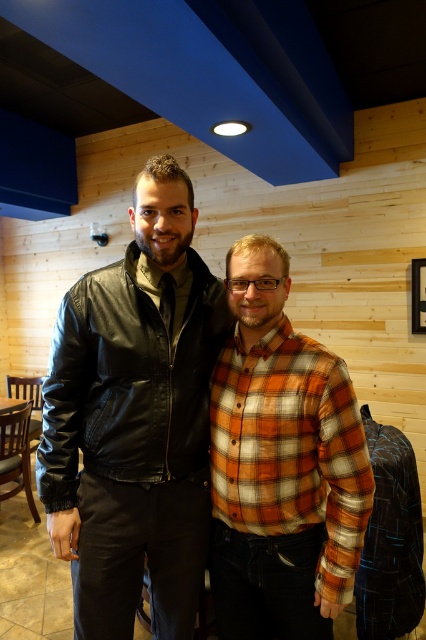
You are a photographer setting up for a portrait. You have a camera with a focal length of 50mm and want to ensure both the black leather jacket at center and orange plaid shirt at center are in focus. Given that the depth of field at this focal length allows objects within 10 centimeters of each other to be in focus, will both subjects be sharp in the photo?

The black leather jacket at center and orange plaid shirt at center are 13.79 centimeters apart from each other. Since the depth of field only allows objects within 10 centimeters to be in focus, the distance between them exceeds this limit. Therefore, both subjects may not be in focus simultaneously.

You are a tailor measuring two garments in the image. The black leather jacket at center and the orange plaid shirt at center are both laid out on a table. Which garment has a greater width?

The black leather jacket at center has a greater width than the orange plaid shirt at center according to the description.

From the picture: You are standing in a cozy indoor space with two people. You need to place a small decoration exactly at point (135, 419). Which object from the scene will this decoration land on?

The decoration will land on the black leather jacket at center because the point (135, 419) is located on it.